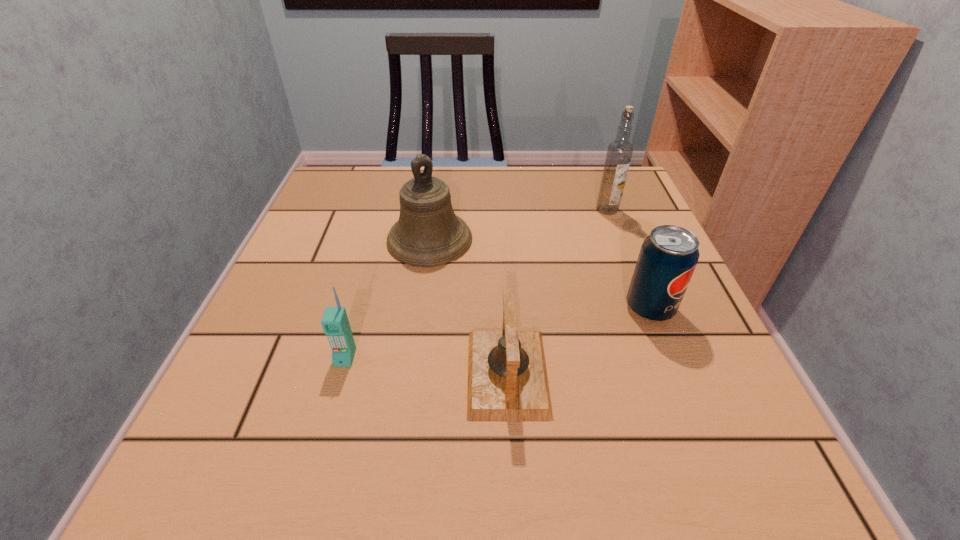
Find the location of `vodka`. vodka is located at coordinates (619, 152).

Identify the location of the farther bell. (428, 233).

Locate an element on the screen. This screenshot has width=960, height=540. the taller bell is located at coordinates (428, 233).

Where is `soda can`? Image resolution: width=960 pixels, height=540 pixels. soda can is located at coordinates (668, 257).

Where is `the leftmost object`? the leftmost object is located at coordinates (335, 323).

Locate an element on the screen. the nearer bell is located at coordinates (507, 377).

Find the location of `the shortest object`. the shortest object is located at coordinates (507, 377).

Locate an element on the screen. vacant area located on the label of the tallest object is located at coordinates (616, 235).

Identify the location of vacant space located on the right of the second tallest object. The image size is (960, 540). (634, 240).

This screenshot has height=540, width=960. I want to click on vacant region located 0.140m on the left of the soda can, so click(546, 308).